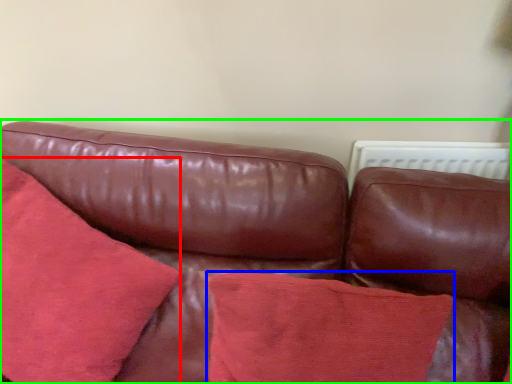
Question: Which is farther away from throw pillow (highlighted by a red box)? throw pillow (highlighted by a blue box) or studio couch (highlighted by a green box)?

Choices:
 (A) throw pillow
 (B) studio couch

Answer: (A)